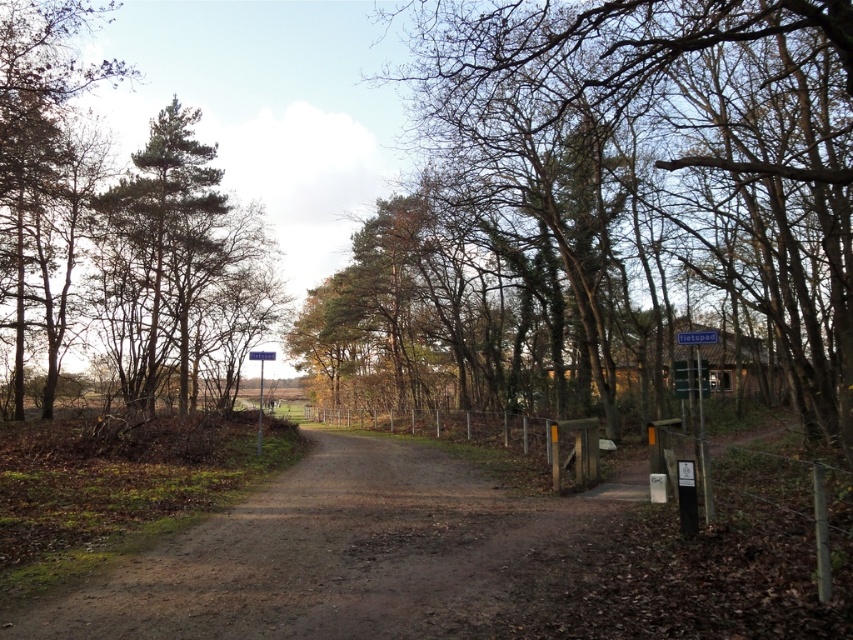
You are standing at the point marked as point (680, 138) in the forest scene. What object is exactly at that location?

The bare wood tree at center is located at point (680, 138).

You are a hiker carrying a backpack and want to take a photo of the blue wooden signpost at right. To get a clear shot, you need to ensure the bare wood tree at center doesn not block the signpost. Based on the scene description, can you determine if the tree is wider than the signpost?

The bare wood tree at center is wider than the blue wooden signpost at right, so it may block the signpost if positioned between you and the signpost.